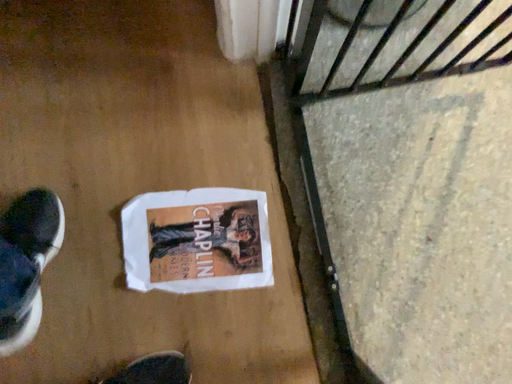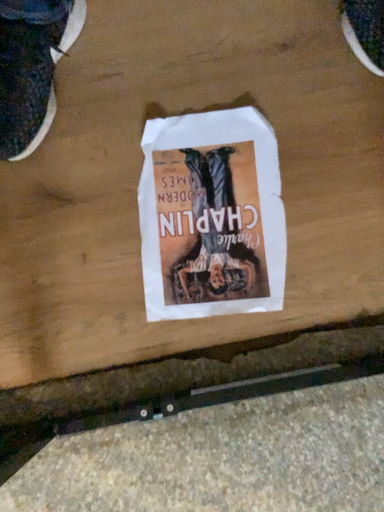
Question: Which way did the camera rotate in the video?

Choices:
 (A) rotated upward
 (B) rotated downward

Answer: (A)